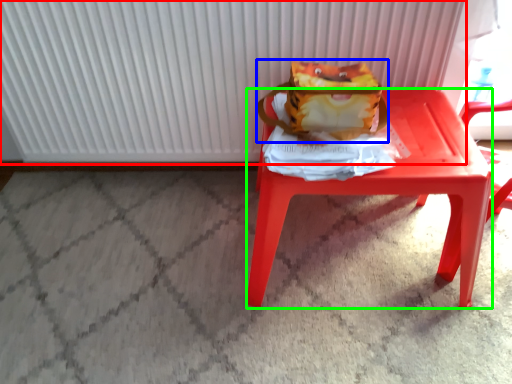
Question: Estimate the real-world distances between objects in this image. Which object is farther from radiator (highlighted by a red box), shoulder bag (highlighted by a blue box) or stool (highlighted by a green box)?

Choices:
 (A) shoulder bag
 (B) stool

Answer: (B)